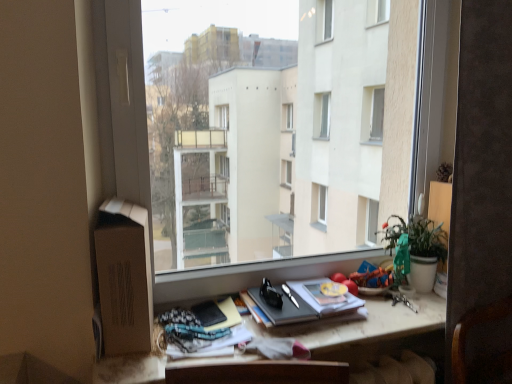
Locate an element on the screen. vacant region above hardcover book at center, which is counted as the second paperback book, starting from the left (from a real-world perspective) is located at coordinates click(308, 291).